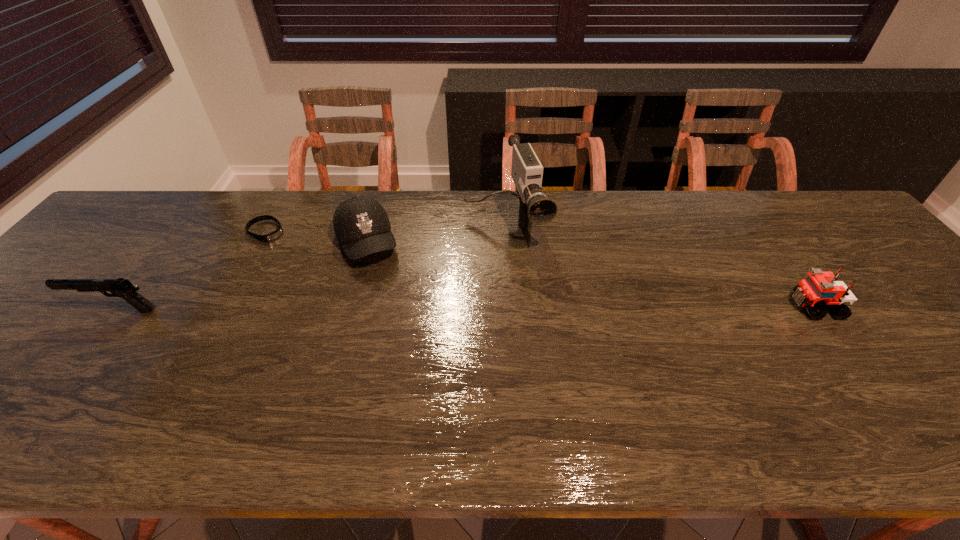
Identify the location of vacant spot on the desktop that is between the leftmost object and the Lego and is positioned on the front-facing side of the baseball cap. (396, 308).

You are a GUI agent. You are given a task and a screenshot of the screen. Output one action in this format:
    pyautogui.click(x=<x>, y=<y>)
    Task: Click on the vacant spot on the desktop that is between the leftmost object and the rightmost object and is positioned on the recording direction of the tallest object
    The height and width of the screenshot is (540, 960).
    Given the screenshot: What is the action you would take?
    point(536,308)

Locate an element on the screen. Image resolution: width=960 pixels, height=540 pixels. vacant spot on the desktop that is between the gun and the Lego and is positioned on the display of the wristband is located at coordinates (378, 308).